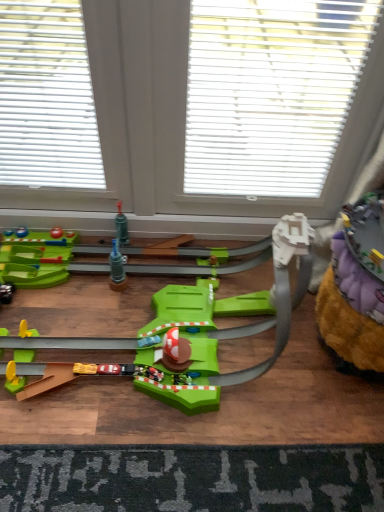
The height and width of the screenshot is (512, 384). What are the coordinates of `vacant region under dark gray textured mat at lower center (from a real-world perspective)` in the screenshot? It's located at coord(205,474).